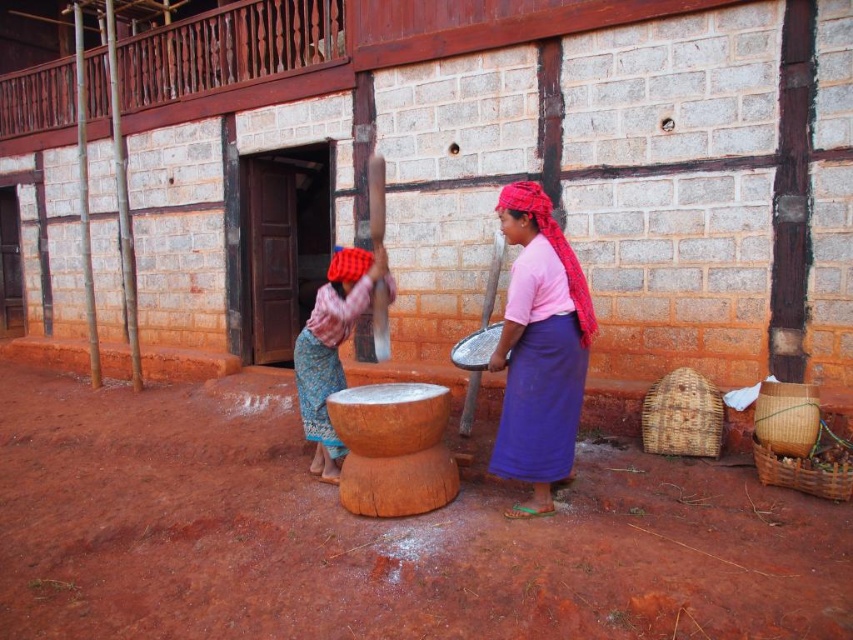
Who is more forward, [544,291] or [328,372]?

Point [544,291]

Between pink fabric skirt at center and matte pink fabric at center, which one is positioned lower?

matte pink fabric at center is below.

Who is more distant from viewer, (561, 435) or (335, 264)?

The point (335, 264) is behind.

The image size is (853, 640). What are the coordinates of `pink fabric skirt at center` in the screenshot? It's located at (538, 348).